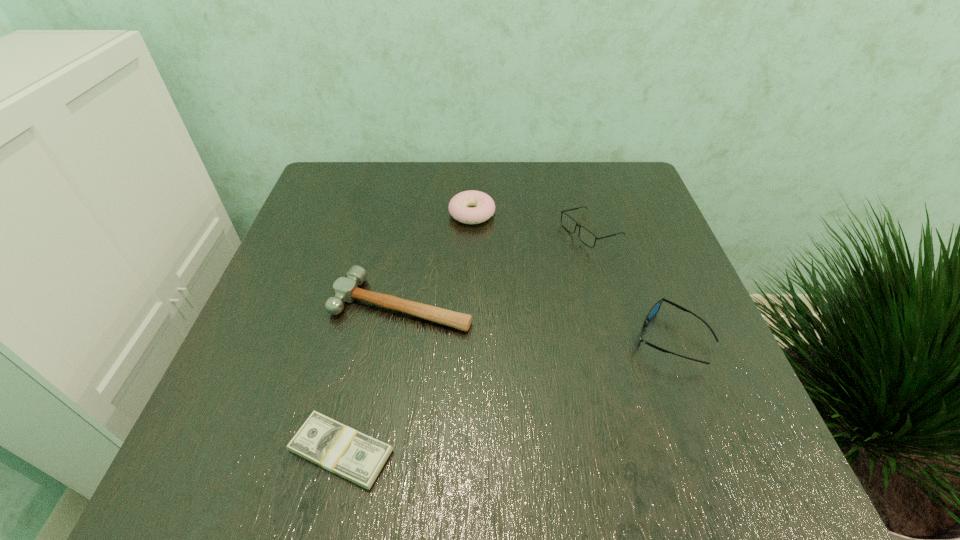
What are the coordinates of `spectacles located at the right edge` in the screenshot? It's located at click(x=586, y=236).

Where is `sunglasses that is at the right edge`? The width and height of the screenshot is (960, 540). sunglasses that is at the right edge is located at coordinates (654, 310).

Locate an element on the screen. object that is positioned at the near left corner is located at coordinates (342, 450).

This screenshot has width=960, height=540. Find the location of `object located at the far right corner`. object located at the far right corner is located at coordinates (586, 236).

What are the coordinates of `vacant space at the far edge` in the screenshot? It's located at (426, 185).

Where is `vacant area at the near edge`? vacant area at the near edge is located at coordinates (543, 464).

This screenshot has width=960, height=540. In the image, there is a desktop. Find the location of `vacant space at the left edge`. vacant space at the left edge is located at coordinates (311, 261).

Find the location of a particular element. The height and width of the screenshot is (540, 960). vacant space at the right edge of the desktop is located at coordinates (633, 271).

The width and height of the screenshot is (960, 540). Identify the location of blank space at the far left corner of the desktop. (359, 211).

Locate an element on the screen. This screenshot has width=960, height=540. vacant space at the near left corner of the desktop is located at coordinates (207, 441).